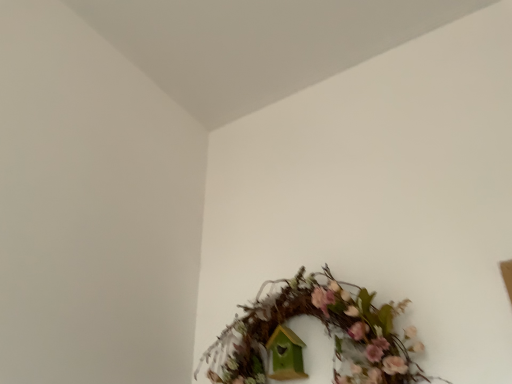
Measure the distance between point (x=369, y=361) and camera.

Point (x=369, y=361) is 34.61 inches from camera.

The image size is (512, 384). Describe the element at coordinates (327, 331) in the screenshot. I see `wooden floral wreath at lower right` at that location.

Image resolution: width=512 pixels, height=384 pixels. Find the location of `wooden floral wreath at lower right`. wooden floral wreath at lower right is located at coordinates (327, 331).

In order to click on wooden floral wreath at lower right in this screenshot , I will do `click(327, 331)`.